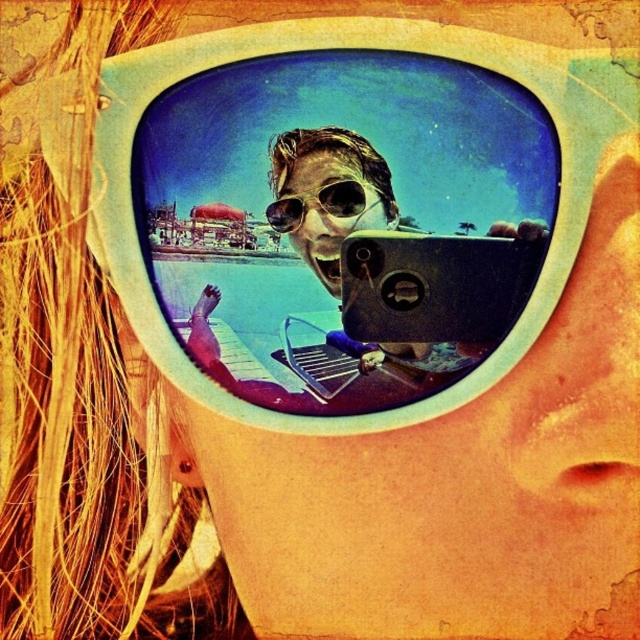
What are the coordinates of the matte plastic face at center in the image?

The coordinates of the matte plastic face at center are at point (326, 208).

You are a photographer trying to capture a clear photo of the matte plastic face at center and the matte white sunglasses at center in the reflection of the sunglasses. Since both objects are in the reflection, which one will appear more sharply focused in the photo?

The matte plastic face at center will appear more sharply focused in the photo because it is closer to the viewer than the matte white sunglasses at center, which is further away.